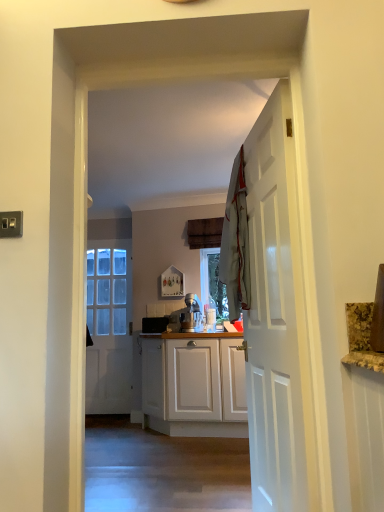
Measure the distance between white wooden door at right, the second door when ordered from left to right, and camera.

The depth of white wooden door at right, the second door when ordered from left to right, is 4.84 feet.

What do you see at coordinates (276, 318) in the screenshot? This screenshot has height=512, width=384. I see `white wooden door at right, the second door when ordered from left to right` at bounding box center [276, 318].

This screenshot has height=512, width=384. I want to click on light gray fabric at center, so click(x=236, y=243).

Locate an element on the screen. white glossy door at center, the second door positioned from the right is located at coordinates (109, 327).

Can you tell me how much light gray fabric at center and white wooden door at right, the 2th door positioned from the back, differ in facing direction?

They differ by 0.00238 degrees in their facing directions.

From the image's perspective, which is above, light gray fabric at center or white wooden door at right, the 2th door positioned from the back?

light gray fabric at center is shown above in the image.

Is light gray fabric at center smaller than white wooden door at right, positioned as the first door in front-to-back order?

Indeed, light gray fabric at center has a smaller size compared to white wooden door at right, positioned as the first door in front-to-back order.

Is light gray fabric at center in front of or behind white wooden door at right, positioned as the first door in front-to-back order, in the image?

Clearly, light gray fabric at center is behind white wooden door at right, positioned as the first door in front-to-back order.

Is light gray fabric at center at the back of white wooden door at right, acting as the first door starting from the right?

Yes, white wooden door at right, acting as the first door starting from the right,'s orientation is away from light gray fabric at center.

Is the surface of white wooden door at right, the 2th door positioned from the back, in direct contact with light gray fabric at center?

There is a gap between white wooden door at right, the 2th door positioned from the back, and light gray fabric at center.

Which object is positioned more to the right, white wooden door at right, the second door when ordered from left to right, or light gray fabric at center?

From the viewer's perspective, white wooden door at right, the second door when ordered from left to right, appears more on the right side.

Considering the sizes of white wooden door at right, positioned as the first door in front-to-back order, and white glossy door at center, arranged as the 2th door when viewed from the front, in the image, is white wooden door at right, positioned as the first door in front-to-back order, bigger or smaller than white glossy door at center, arranged as the 2th door when viewed from the front,?

Considering their sizes, white wooden door at right, positioned as the first door in front-to-back order, takes up more space than white glossy door at center, arranged as the 2th door when viewed from the front.

Is white wooden door at right, positioned as the first door in front-to-back order, directly adjacent to white glossy door at center, the first door when ordered from left to right?

No, white wooden door at right, positioned as the first door in front-to-back order, is not touching white glossy door at center, the first door when ordered from left to right.

Considering the relative positions of white wooden door at right, acting as the first door starting from the right, and white glossy door at center, arranged as the 2th door when viewed from the front, in the image provided, is white wooden door at right, acting as the first door starting from the right, in front of white glossy door at center, arranged as the 2th door when viewed from the front,?

That is True.

How many degrees apart are the facing directions of white wooden door at right, the second door when ordered from left to right, and white glossy door at center, arranged as the 2th door when viewed from the front?

80 degrees.

Considering the positions of point (99, 388) and point (229, 243), is point (99, 388) closer or farther from the camera than point (229, 243)?

Point (99, 388) appears to be farther away from the viewer than point (229, 243).

Looking at their sizes, would you say white glossy door at center, the second door positioned from the right, is wider or thinner than light gray fabric at center?

white glossy door at center, the second door positioned from the right, is thinner than light gray fabric at center.

Considering the relative sizes of white glossy door at center, the first door when ordered from back to front, and light gray fabric at center in the image provided, is white glossy door at center, the first door when ordered from back to front, bigger than light gray fabric at center?

Yes.

Is white glossy door at center, the first door when ordered from back to front, positioned with its back to white wooden door at right, the 2th door positioned from the back?

white glossy door at center, the first door when ordered from back to front, is not turned away from white wooden door at right, the 2th door positioned from the back.

From a real-world perspective, between white glossy door at center, the first door when ordered from back to front, and white wooden door at right, the 2th door positioned from the back, who is vertically lower?

white wooden door at right, the 2th door positioned from the back, is physically lower.

Considering the relative positions of white glossy door at center, the second door positioned from the right, and white wooden door at right, the second door when ordered from left to right, in the image provided, is white glossy door at center, the second door positioned from the right, to the left of white wooden door at right, the second door when ordered from left to right, from the viewer's perspective?

Yes.

How many degrees apart are the facing directions of white glossy door at center, the second door positioned from the right, and white wooden door at right, acting as the first door starting from the right?

They differ by 80 degrees in their facing directions.

Is light gray fabric at center positioned far away from white glossy door at center, arranged as the 2th door when viewed from the front?

light gray fabric at center is far away from white glossy door at center, arranged as the 2th door when viewed from the front.

Which is in front, light gray fabric at center or white glossy door at center, arranged as the 2th door when viewed from the front?

Positioned in front is light gray fabric at center.

Considering the relative positions of light gray fabric at center and white glossy door at center, the first door when ordered from back to front, in the image provided, is light gray fabric at center to the left of white glossy door at center, the first door when ordered from back to front, from the viewer's perspective?

Incorrect, light gray fabric at center is not on the left side of white glossy door at center, the first door when ordered from back to front.

Locate an element on the screen. door on the right of light gray fabric at center is located at coordinates [276, 318].

This screenshot has width=384, height=512. What are the coordinates of `laundry located above the white wooden door at right, positioned as the first door in front-to-back order (from the image's perspective)` in the screenshot? It's located at (236, 243).

Based on their spatial positions, is light gray fabric at center or white glossy door at center, arranged as the 2th door when viewed from the front, further from white wooden door at right, positioned as the first door in front-to-back order?

The object further to white wooden door at right, positioned as the first door in front-to-back order, is white glossy door at center, arranged as the 2th door when viewed from the front.

Estimate the real-world distances between objects in this image. Which object is further from white wooden door at right, the 2th door positioned from the back, white glossy door at center, the first door when ordered from back to front, or light gray fabric at center?

white glossy door at center, the first door when ordered from back to front.

Estimate the real-world distances between objects in this image. Which object is further from light gray fabric at center, white glossy door at center, the second door positioned from the right, or white wooden door at right, the 2th door positioned from the back?

white glossy door at center, the second door positioned from the right, is further to light gray fabric at center.

Based on the photo, when comparing their distances from light gray fabric at center, does white wooden door at right, the second door when ordered from left to right, or white glossy door at center, the first door when ordered from back to front, seem further?

white glossy door at center, the first door when ordered from back to front, is positioned further to the anchor light gray fabric at center.

From the image, which object appears to be nearer to white glossy door at center, the first door when ordered from back to front, light gray fabric at center or white wooden door at right, acting as the first door starting from the right?

light gray fabric at center is positioned closer to the anchor white glossy door at center, the first door when ordered from back to front.

When comparing their distances from white glossy door at center, the second door positioned from the right, does white wooden door at right, positioned as the first door in front-to-back order, or light gray fabric at center seem further?

The object further to white glossy door at center, the second door positioned from the right, is white wooden door at right, positioned as the first door in front-to-back order.

Find the location of `laundry between white wooden door at right, acting as the first door starting from the right, and white glossy door at center, the first door when ordered from left to right, from front to back`. laundry between white wooden door at right, acting as the first door starting from the right, and white glossy door at center, the first door when ordered from left to right, from front to back is located at coordinates (236, 243).